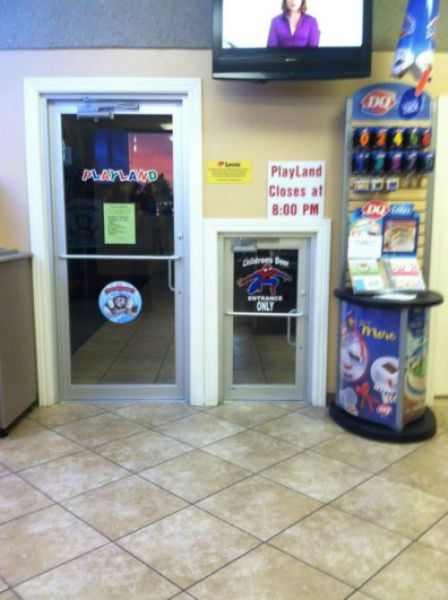
You are a GUI agent. You are given a task and a screenshot of the screen. Output one action in this format:
    pyautogui.click(x=<x>, y=<y>)
    Task: Click on the side counter
    The width and height of the screenshot is (448, 600).
    Given the screenshot: What is the action you would take?
    pyautogui.click(x=18, y=340)